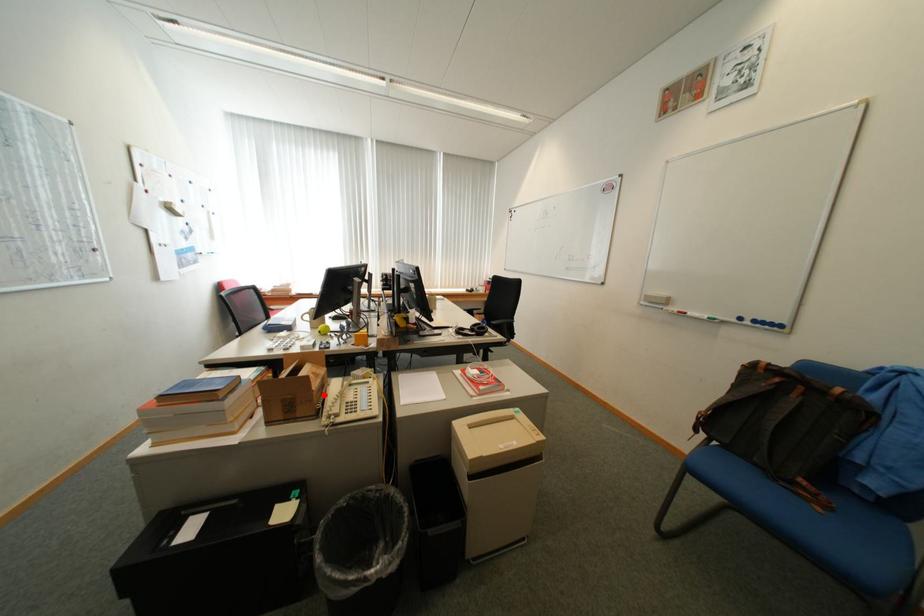
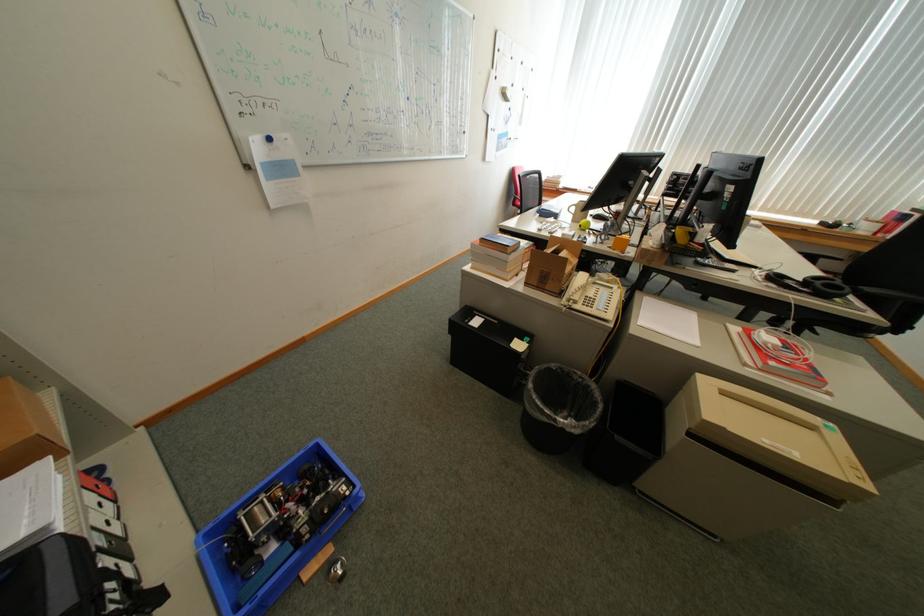
Locate, in the second image, the point that corresponds to the highlighted location in the first image.

(575, 277)